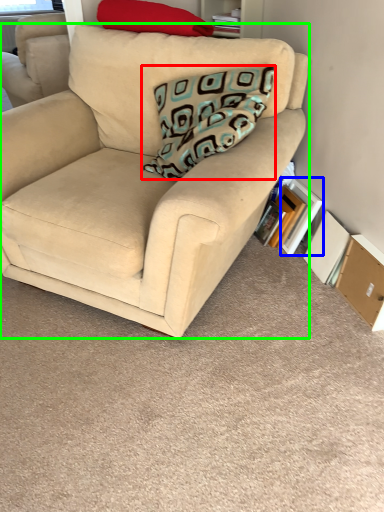
Question: Estimate the real-world distances between objects in this image. Which object is closer to pillow (highlighted by a red box), paperback book (highlighted by a blue box) or studio couch (highlighted by a green box)?

Choices:
 (A) paperback book
 (B) studio couch

Answer: (B)